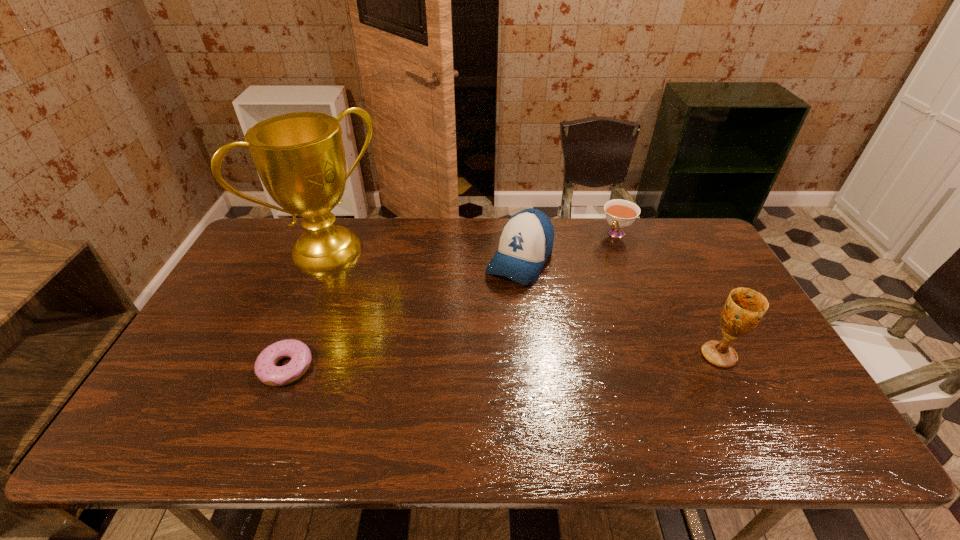
At what (x,y) coordinates should I click in order to perform the action: click on vacant spot on the desktop that is between the doughnut and the second tallest object and is positioned on the front-facing side of the baseball cap. Please return your answer as a coordinate pair (x, y). The width and height of the screenshot is (960, 540). Looking at the image, I should click on (454, 362).

Image resolution: width=960 pixels, height=540 pixels. Identify the location of free space on the desktop that is between the shortest object and the chalice and is positioned on the shiny surface of the tallest object. click(x=456, y=362).

The height and width of the screenshot is (540, 960). Find the location of `free space on the desktop that is between the doughnut and the rightmost object and is positioned on the side of the teacup with the handle`. free space on the desktop that is between the doughnut and the rightmost object and is positioned on the side of the teacup with the handle is located at coordinates (532, 360).